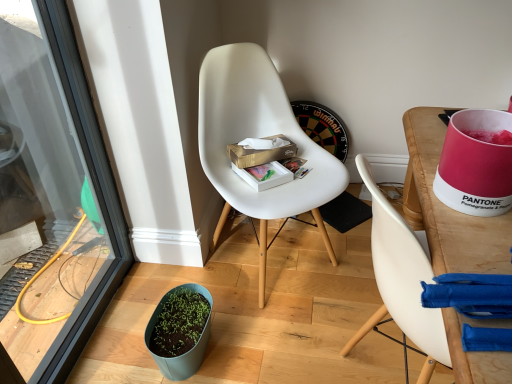
Locate an element on the screen. Image resolution: width=512 pixels, height=384 pixels. blank space situated above white matte box at center, placed as the 1th box when sorted from bottom to top (from a real-world perspective) is located at coordinates pos(254,161).